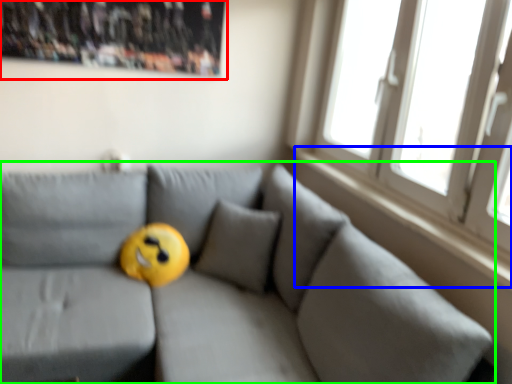
Question: Which object is positioned closest to bulletin board (highlighted by a red box)? Select from window sill (highlighted by a blue box) and studio couch (highlighted by a green box).

Choices:
 (A) window sill
 (B) studio couch

Answer: (B)